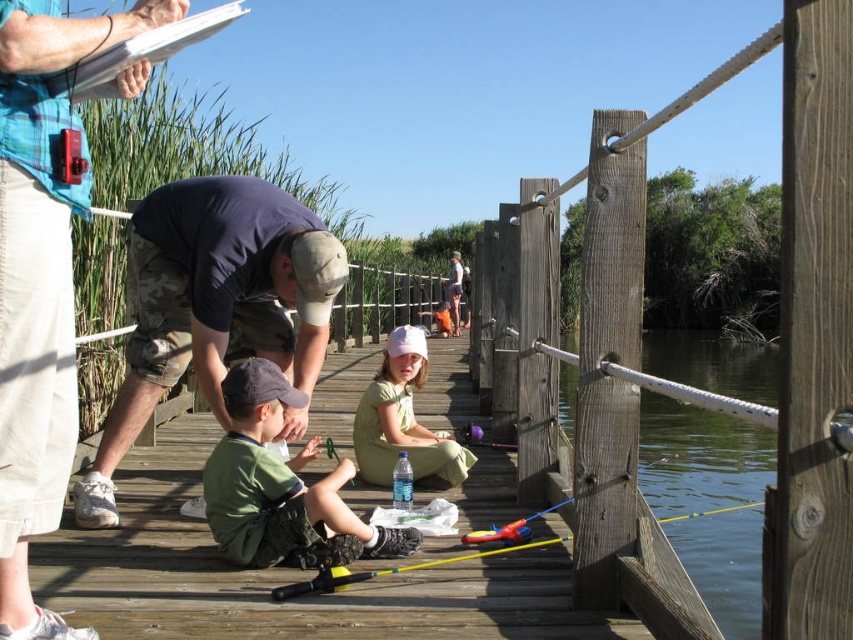
Question: Which object appears closest to the camera in this image?

Choices:
 (A) clear water at post right
 (B) dark blue/camo pants at center

Answer: (B)

Question: Which point is farther to the camera?

Choices:
 (A) (293, 378)
 (B) (680, 419)
 (C) (3, 440)
 (D) (221, 513)

Answer: (B)

Question: Is camouflage pants at left to the left of dark blue/camo pants at center from the viewer's perspective?

Choices:
 (A) no
 (B) yes

Answer: (A)

Question: Can you confirm if camouflage pants at left is positioned to the left of dark blue/camo pants at center?

Choices:
 (A) yes
 (B) no

Answer: (B)

Question: Estimate the real-world distances between objects in this image. Which object is farther from the clear water at post right?

Choices:
 (A) camouflage pants at left
 (B) dark blue/camo pants at center
 (C) green matte shirt at center

Answer: (A)

Question: Is green matte shirt at center to the right of clear water at post right from the viewer's perspective?

Choices:
 (A) yes
 (B) no

Answer: (B)